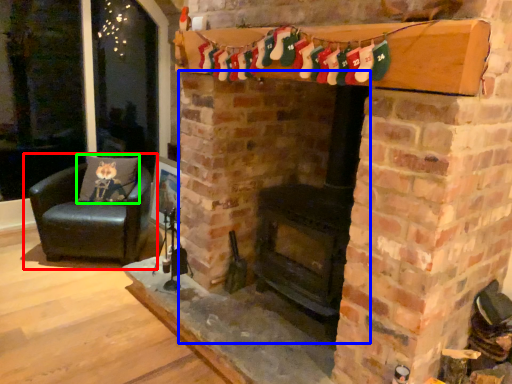
Question: Estimate the real-world distances between objects in this image. Which object is closer to chair (highlighted by a red box), fireplace (highlighted by a blue box) or pillow (highlighted by a green box)?

Choices:
 (A) fireplace
 (B) pillow

Answer: (B)